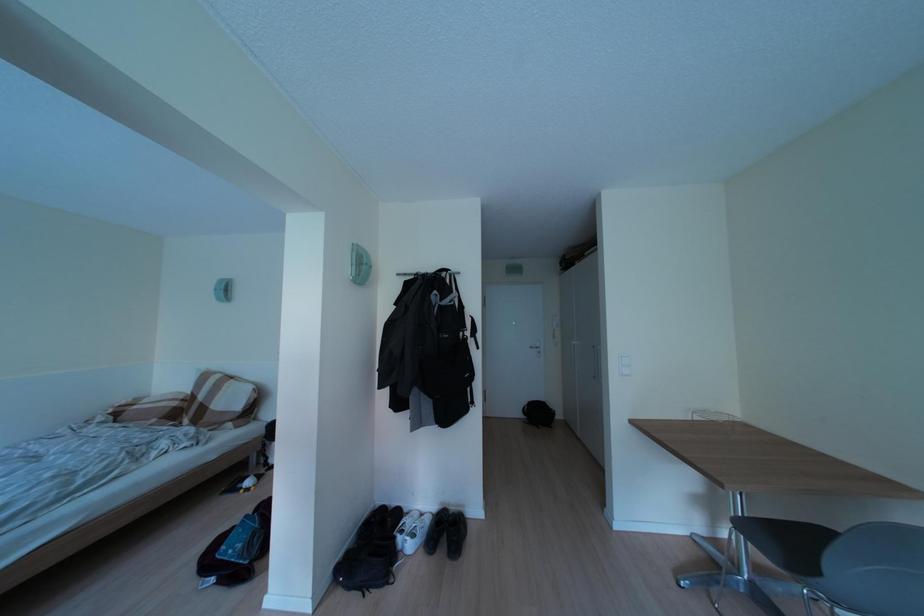
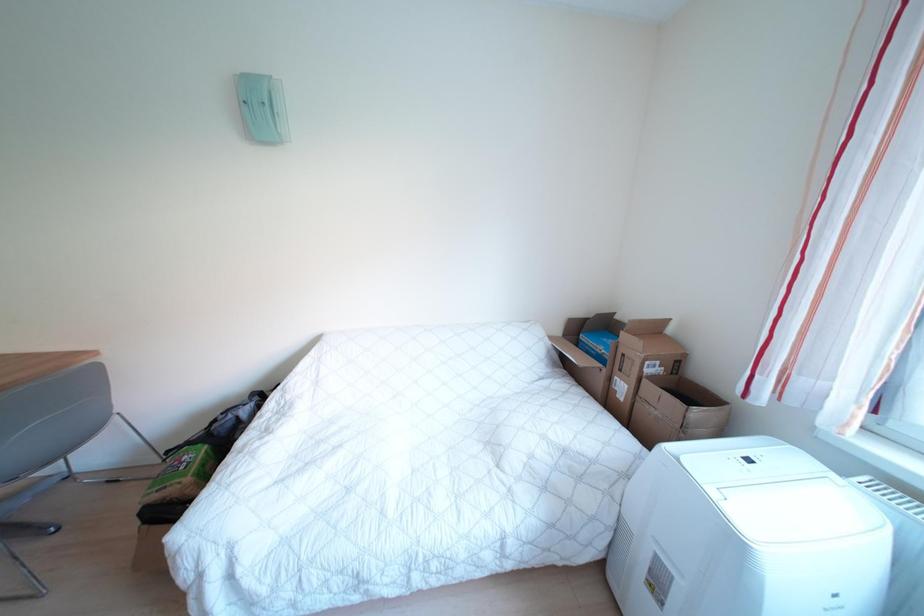
Question: The first image is from the beginning of the video and the second image is from the end. How did the camera likely rotate when shooting the video?

Choices:
 (A) Left
 (B) Right
 (C) Up
 (D) Down

Answer: (B)